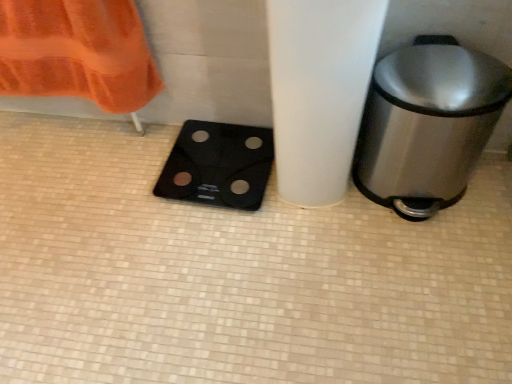
Question: Is point pos(368,134) positioned closer to the camera than point pos(194,140)?

Choices:
 (A) closer
 (B) farther

Answer: (A)

Question: From the image's perspective, relative to black glass scale at lower left, is polished stainless steel trash can at right above or below?

Choices:
 (A) above
 (B) below

Answer: (A)

Question: From a real-world perspective, is polished stainless steel trash can at right above or below black glass scale at lower left?

Choices:
 (A) below
 (B) above

Answer: (B)

Question: Is black glass scale at lower left inside the boundaries of polished stainless steel trash can at right, or outside?

Choices:
 (A) inside
 (B) outside

Answer: (B)

Question: Considering the positions of black glass scale at lower left and polished stainless steel trash can at right in the image, is black glass scale at lower left wider or thinner than polished stainless steel trash can at right?

Choices:
 (A) wide
 (B) thin

Answer: (A)

Question: From a real-world perspective, is black glass scale at lower left positioned above or below polished stainless steel trash can at right?

Choices:
 (A) above
 (B) below

Answer: (B)

Question: Considering their positions, is black glass scale at lower left located in front of or behind polished stainless steel trash can at right?

Choices:
 (A) behind
 (B) front

Answer: (A)